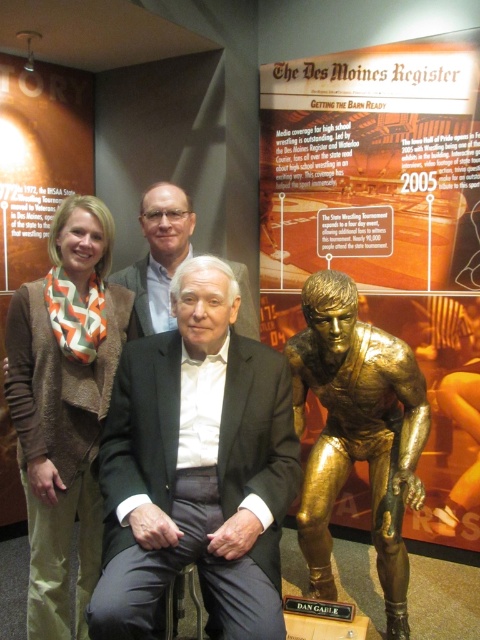
Does brown chevron scarf at upper left have a greater height compared to orange chevron scarf at left?

Incorrect, brown chevron scarf at upper left's height is not larger of orange chevron scarf at left's.

Does point (36, 564) lie in front of point (10, 285)?

Yes, it is.

Where is `brown chevron scarf at upper left`? brown chevron scarf at upper left is located at coordinates (64, 404).

Does brown chevron scarf at upper left appear over white textured suit at center?

Incorrect, brown chevron scarf at upper left is not positioned above white textured suit at center.

Does point (70, 320) come farther from viewer compared to point (156, 208)?

No, (70, 320) is closer to viewer.

Which is behind, point (98, 200) or point (143, 330)?

The point (143, 330) is more distant.

In order to click on brown chevron scarf at upper left in this screenshot , I will do `click(64, 404)`.

Is brown chevron scarf at upper left taller than gold-bronze figure at center-right?

Correct, brown chevron scarf at upper left is much taller as gold-bronze figure at center-right.

Which is more to the right, brown chevron scarf at upper left or gold-bronze figure at center-right?

gold-bronze figure at center-right

Who is more forward, (87, 397) or (380, 566)?

Point (87, 397) is more forward.

Image resolution: width=480 pixels, height=640 pixels. In order to click on brown chevron scarf at upper left in this screenshot , I will do `click(64, 404)`.